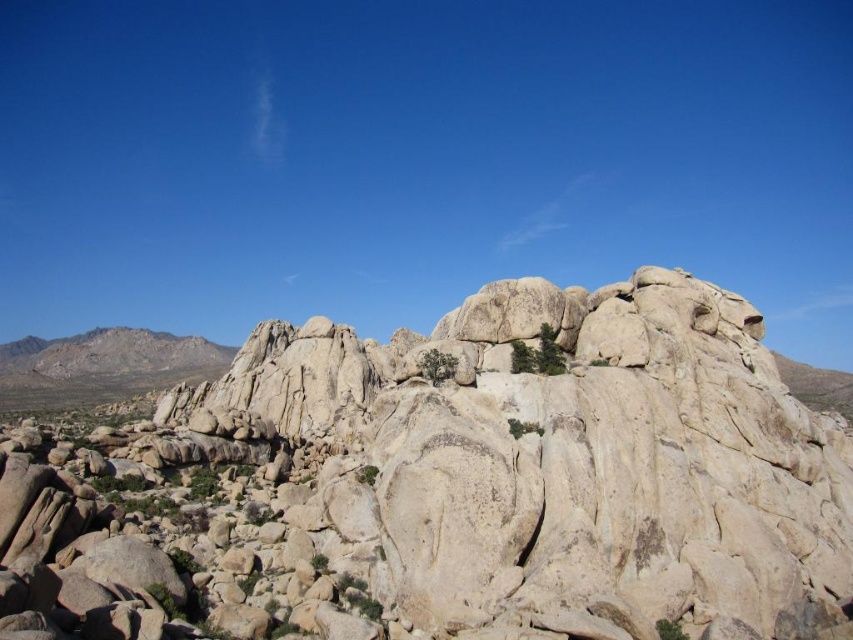
You are hiking and want to take a photo of both the granite rock formation at center and the rugged stone mountain at left. Based on their positions, which one should you focus on first to ensure both are in the frame?

You should focus on the granite rock formation at center first since it is closer to you than the rugged stone mountain at left, allowing both to be captured in the frame.

You are a hiker planning to cross the rocky terrain in the image. You need to choose between the granite rock formation at center and the rugged stone mountain at left. Which option requires less effort to climb?

The granite rock formation at center requires less effort to climb because it has a smaller size compared to the rugged stone mountain at left.

You are standing at the origin point of the coordinate system in this rocky landscape. Where is the granite rock formation at center located in terms of its 2D coordinates?

The granite rock formation at center is located at the 2D coordinates of point (456, 483).